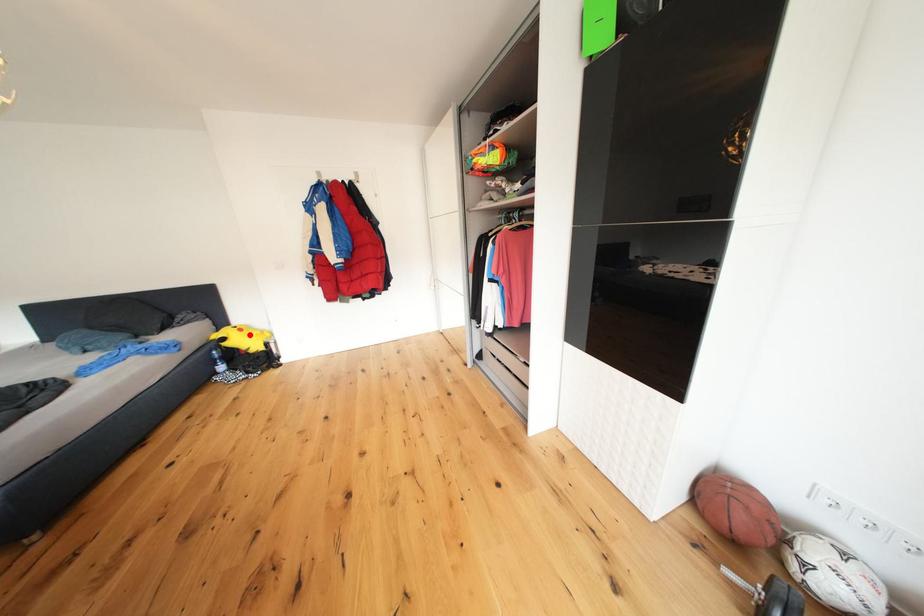
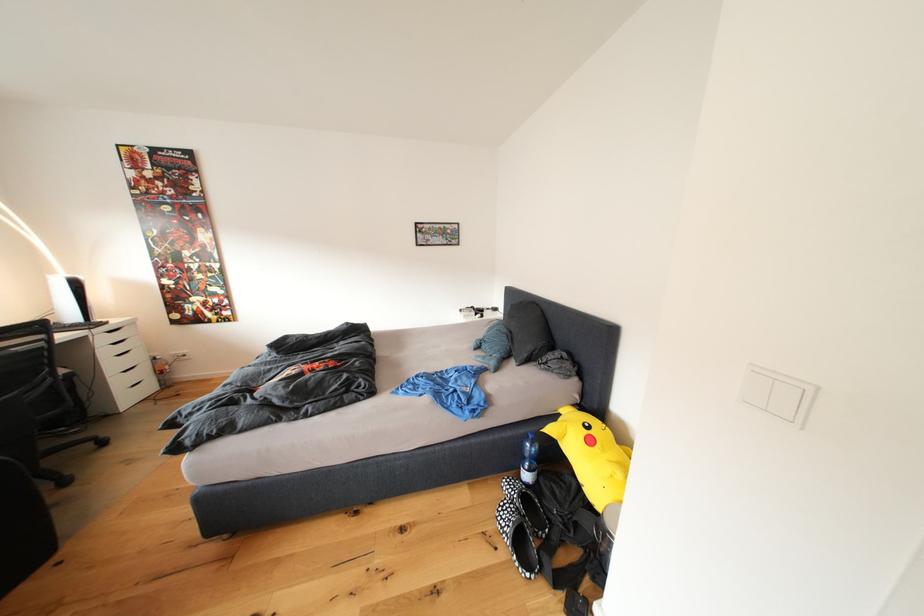
Find the pixel in the second image that matches the highlighted location in the first image.

(600, 446)